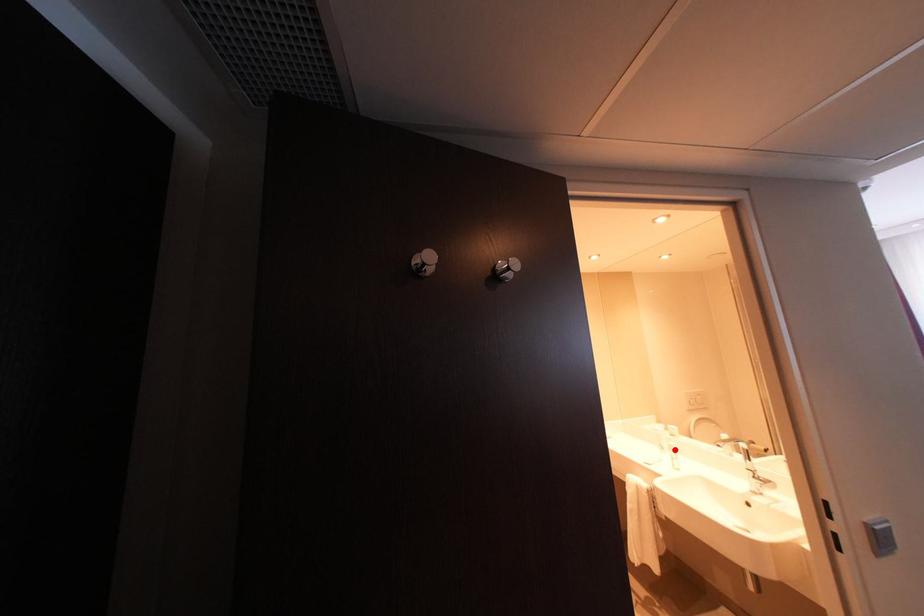
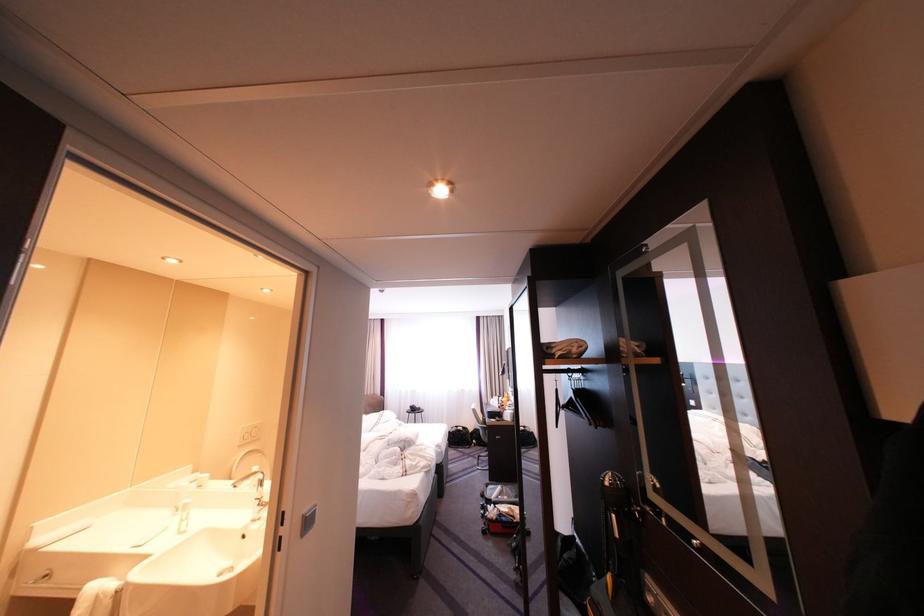
In the second image, find the point that corresponds to the highlighted location in the first image.

(189, 511)